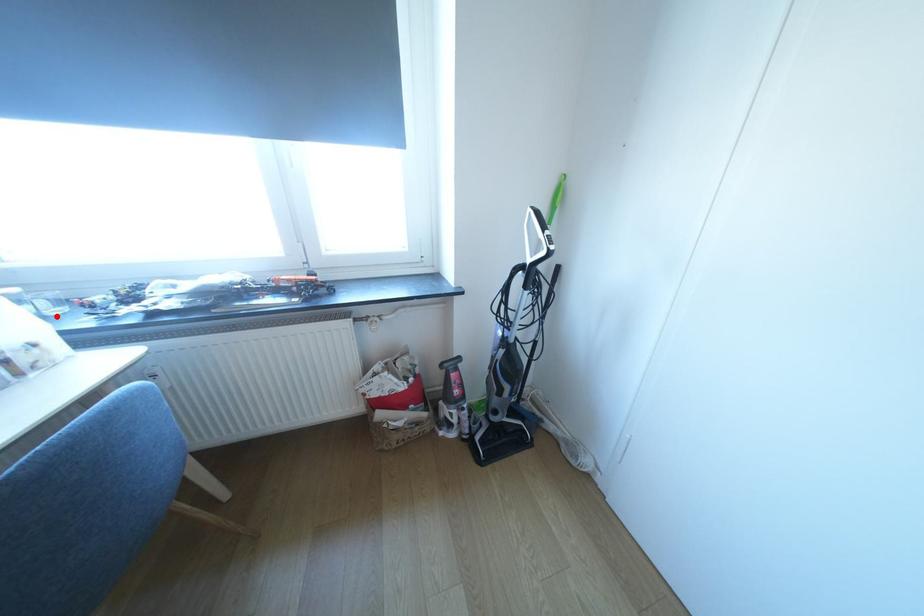
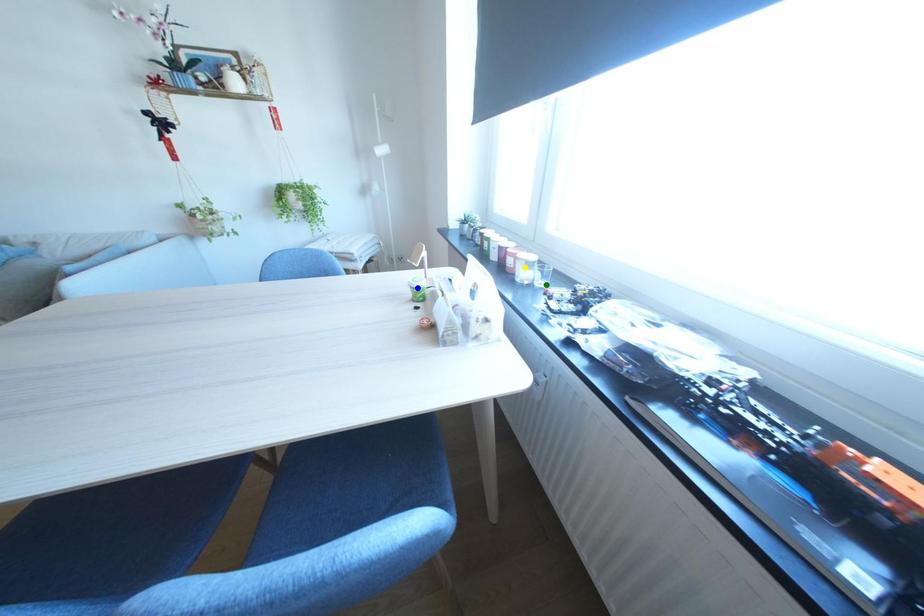
Question: I am providing you with two images of the same scene from different viewpoints. A red point is marked on the first image. You are given multiple points on the second image. Which mark in image 2 goes with the point in image 1?

Choices:
 (A) green point
 (B) yellow point
 (C) blue point

Answer: (A)